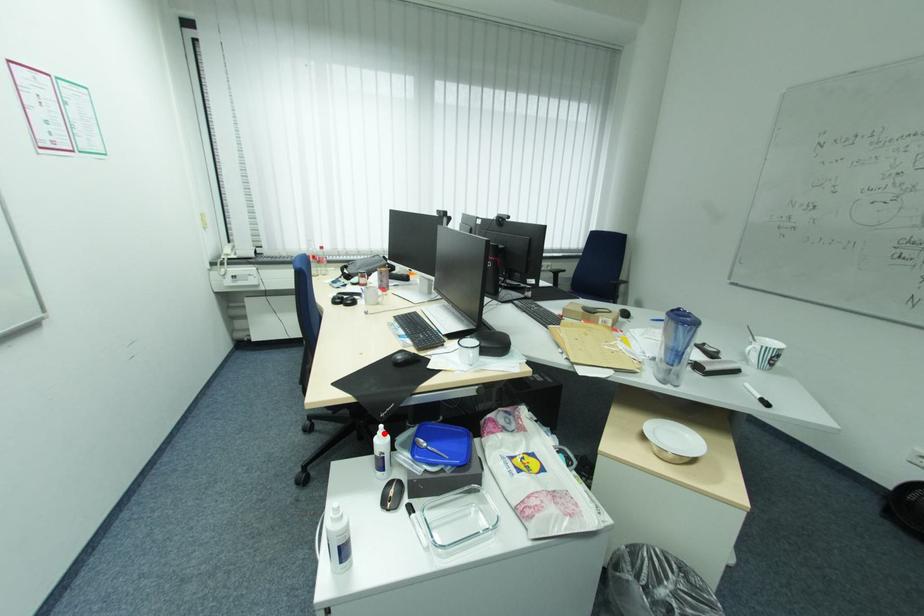
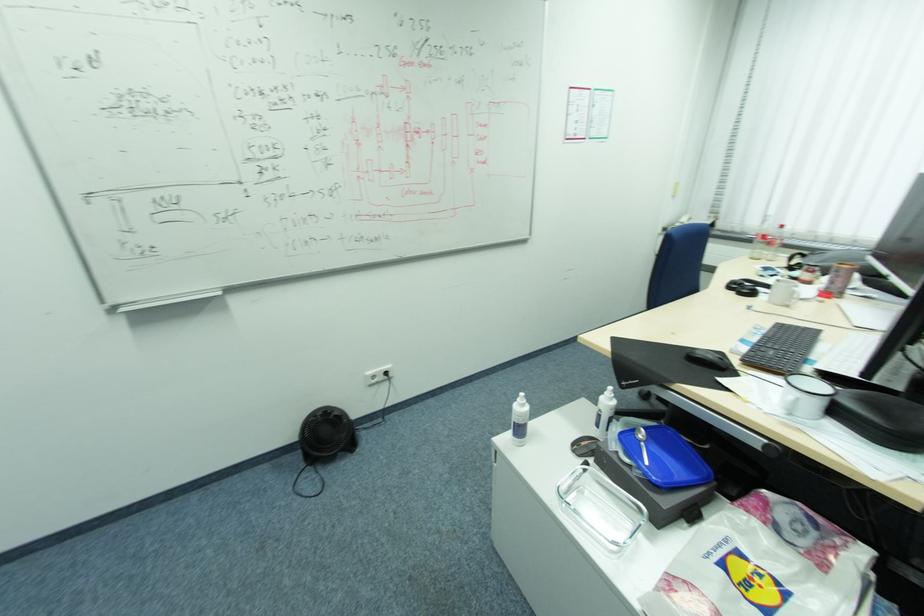
The point at the highlighted location is marked in the first image. Where is the corresponding point in the second image?

(612, 392)